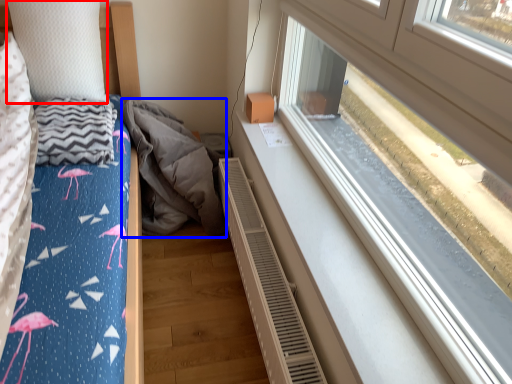
Question: Which of the following is the farthest to the observer, pillow (highlighted by a red box) or material (highlighted by a blue box)?

Choices:
 (A) pillow
 (B) material

Answer: (B)